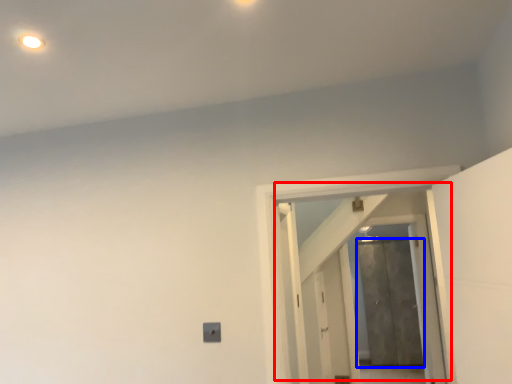
Question: Among these objects, which one is farthest to the camera, door (highlighted by a red box) or door (highlighted by a blue box)?

Choices:
 (A) door
 (B) door

Answer: (B)